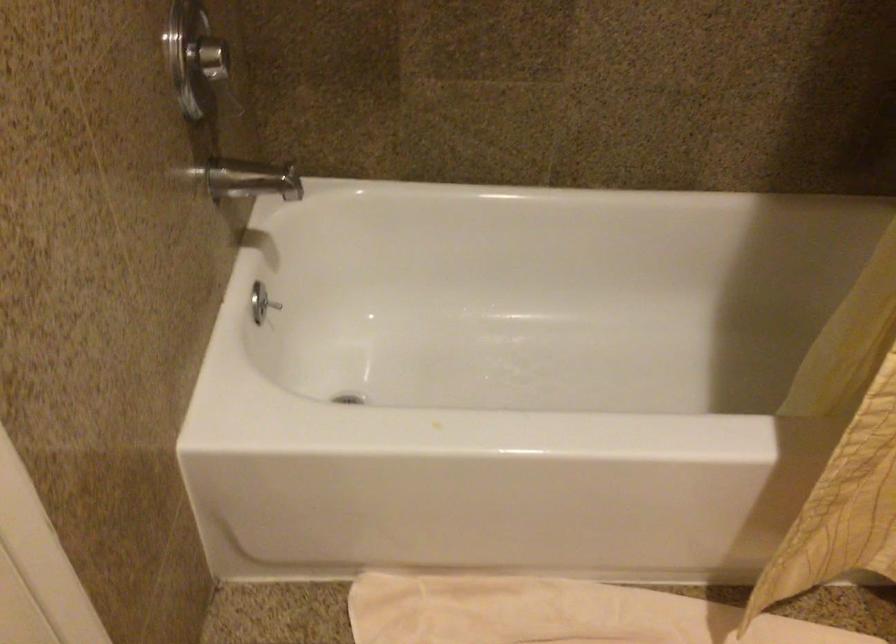
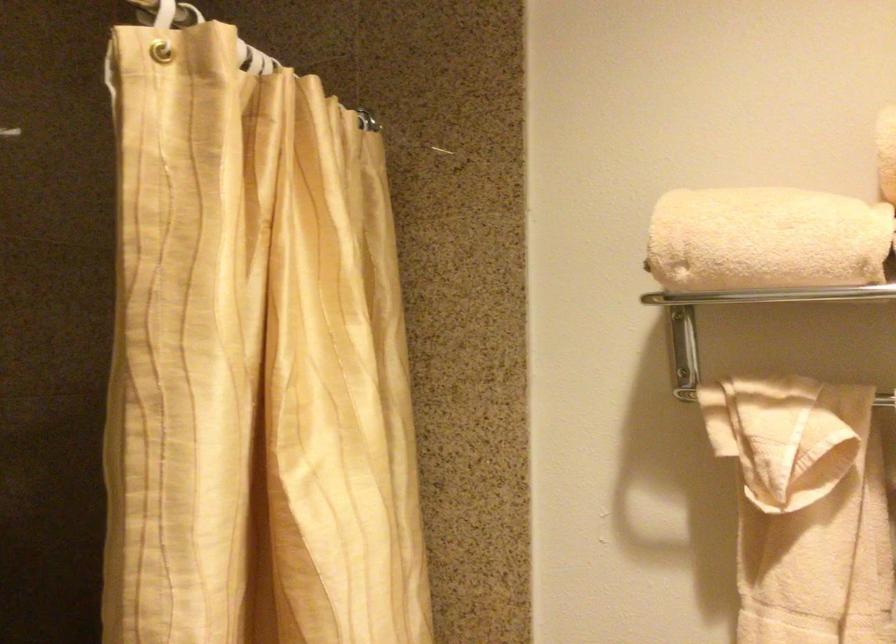
The images are taken continuously from a first-person perspective. In which direction is your viewpoint rotating?

The camera's rotation is toward right-up.